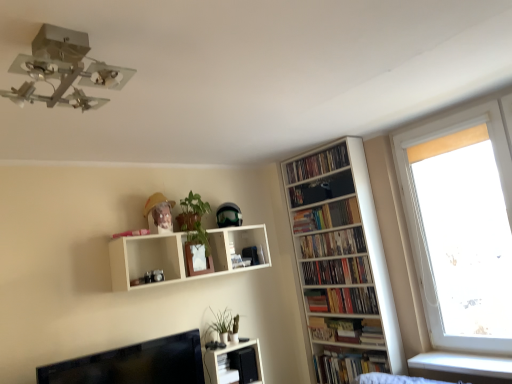
The height and width of the screenshot is (384, 512). I want to click on vacant area on top of transparent glass window at upper right (from a real-world perspective), so click(439, 110).